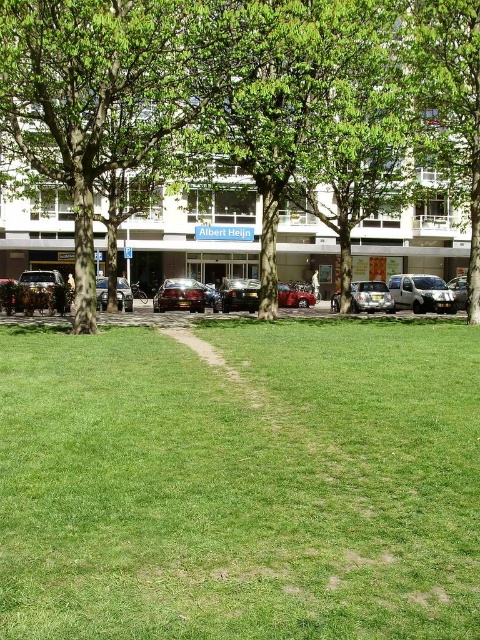
Question: Does green grassy at center appear on the right side of shiny silver car at center?

Choices:
 (A) no
 (B) yes

Answer: (A)

Question: Among these objects, which one is farthest from the camera?

Choices:
 (A) shiny silver suv at left
 (B) metallic silver van at center
 (C) green grassy at center
 (D) shiny metallic car at center

Answer: (B)

Question: Where is shiny silver car at center located in relation to shiny silver sedan at center in the image?

Choices:
 (A) left
 (B) right

Answer: (B)

Question: Which object is the farthest from the metallic silver van at center?

Choices:
 (A) green grassy at center
 (B) shiny silver suv at left

Answer: (A)

Question: Is green grassy at center closer to the viewer compared to shiny metallic car at center?

Choices:
 (A) no
 (B) yes

Answer: (B)

Question: Which point is farther from the camera taking this photo?

Choices:
 (A) (55, 282)
 (B) (170, 296)
 (C) (442, 285)
 (D) (216, 3)

Answer: (C)